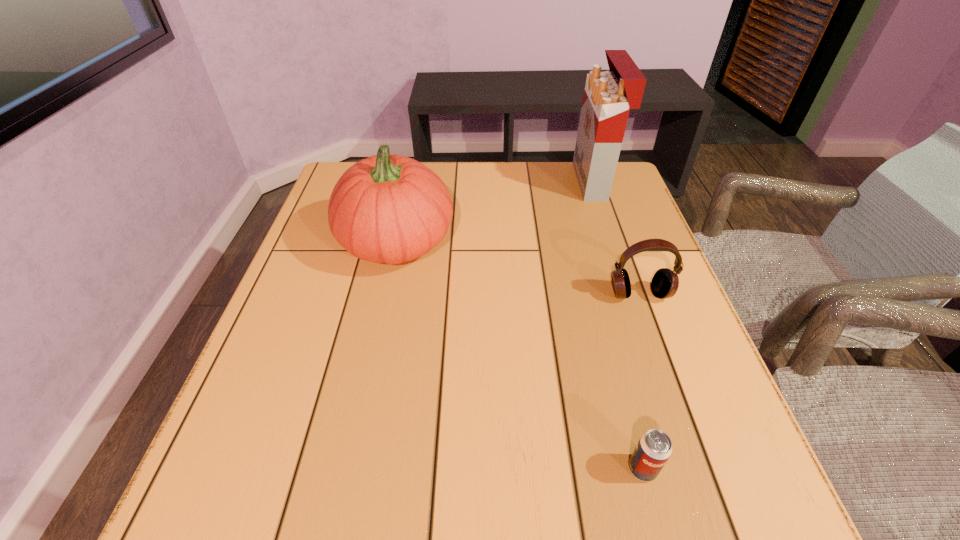
Find the location of a particular element. The height and width of the screenshot is (540, 960). free location located 0.320m with the lid open on the farthest object is located at coordinates (467, 181).

Identify the location of free space located 0.090m on the front of the pumpkin. The width and height of the screenshot is (960, 540). (381, 314).

Where is `vacant area situated 0.140m on the ear pads of the headset`? vacant area situated 0.140m on the ear pads of the headset is located at coordinates (663, 361).

In order to click on vacant space positioned 0.060m on the right of the third object from right to left in this screenshot , I will do `click(696, 469)`.

Image resolution: width=960 pixels, height=540 pixels. What are the coordinates of `cigarette case that is at the far edge` in the screenshot? It's located at (608, 96).

Locate an element on the screen. pumpkin that is at the far edge is located at coordinates (390, 209).

Find the location of a particular element. This screenshot has width=960, height=540. object that is at the near edge is located at coordinates (654, 448).

Where is `object at the left edge`? The width and height of the screenshot is (960, 540). object at the left edge is located at coordinates (390, 209).

Where is `cigarette case situated at the right edge`? This screenshot has height=540, width=960. cigarette case situated at the right edge is located at coordinates (608, 96).

Where is `headset that is at the right edge`? This screenshot has height=540, width=960. headset that is at the right edge is located at coordinates (665, 282).